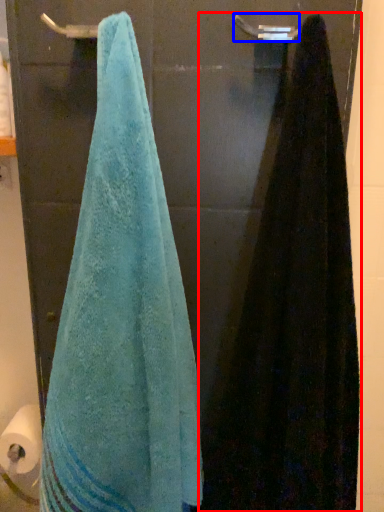
Question: Which of the following is the closest to the observer, towel (highlighted by a red box) or towel bar (highlighted by a blue box)?

Choices:
 (A) towel
 (B) towel bar

Answer: (A)